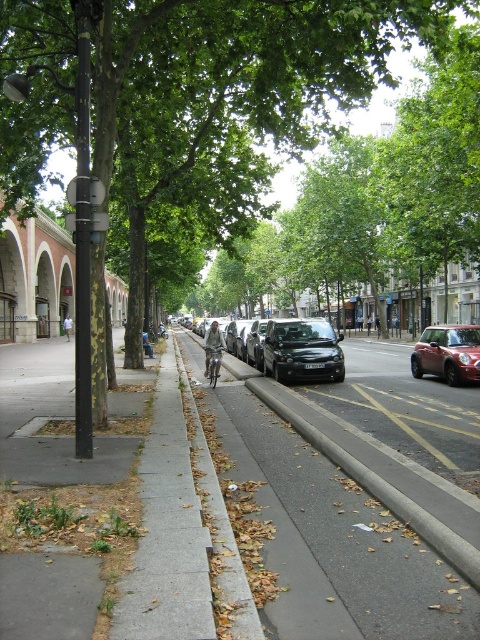
Question: Can you confirm if gray concrete curb at lower center is positioned to the left of metallic silver bike at center?

Choices:
 (A) no
 (B) yes

Answer: (B)

Question: Which object is farther from the camera taking this photo?

Choices:
 (A) gray fabric jacket at center
 (B) gray concrete curb at lower center
 (C) metallic silver bike at center

Answer: (C)

Question: Is gray fabric jacket at center bigger than khaki cotton shorts at center?

Choices:
 (A) no
 (B) yes

Answer: (A)

Question: Estimate the real-world distances between objects in this image. Which object is farther from the green leafy tree at left?

Choices:
 (A) gray fabric jacket at center
 (B) black matte car at center
 (C) metallic red car at right

Answer: (C)

Question: Which point is closer to the camera?

Choices:
 (A) (216, 332)
 (B) (466, 362)
 (C) (69, 326)

Answer: (B)

Question: Does gray concrete curb at lower center appear over metallic red car at right?

Choices:
 (A) yes
 (B) no

Answer: (B)